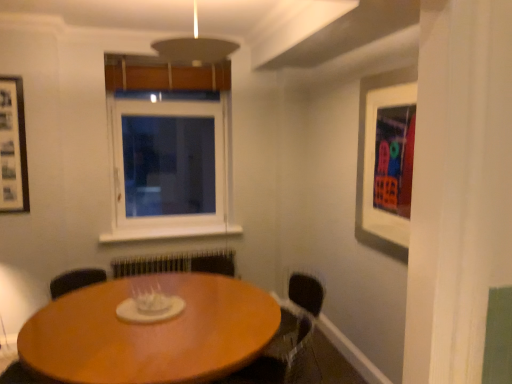
Question: In terms of height, does wooden table at center look taller or shorter compared to white matte picture frame at upper right, which is the 1th picture frame in front-to-back order?

Choices:
 (A) short
 (B) tall

Answer: (A)

Question: Does point (42, 312) appear closer or farther from the camera than point (411, 76)?

Choices:
 (A) closer
 (B) farther

Answer: (A)

Question: Based on their relative distances, which object is farther from the black matte picture frame at left, which is counted as the 2th picture frame, starting from the front?

Choices:
 (A) white matte picture frame at upper right, marked as the second picture frame in a back-to-front arrangement
 (B) wooden table at center
 (C) white plastic window at center
 (D) matte black armchair at lower right

Answer: (A)

Question: Which object is positioned closest to the white plastic window at center?

Choices:
 (A) matte black armchair at lower right
 (B) black matte picture frame at left, placed as the 2th picture frame when sorted from right to left
 (C) wooden table at center
 (D) white matte picture frame at upper right, placed as the 1th picture frame when sorted from right to left

Answer: (B)